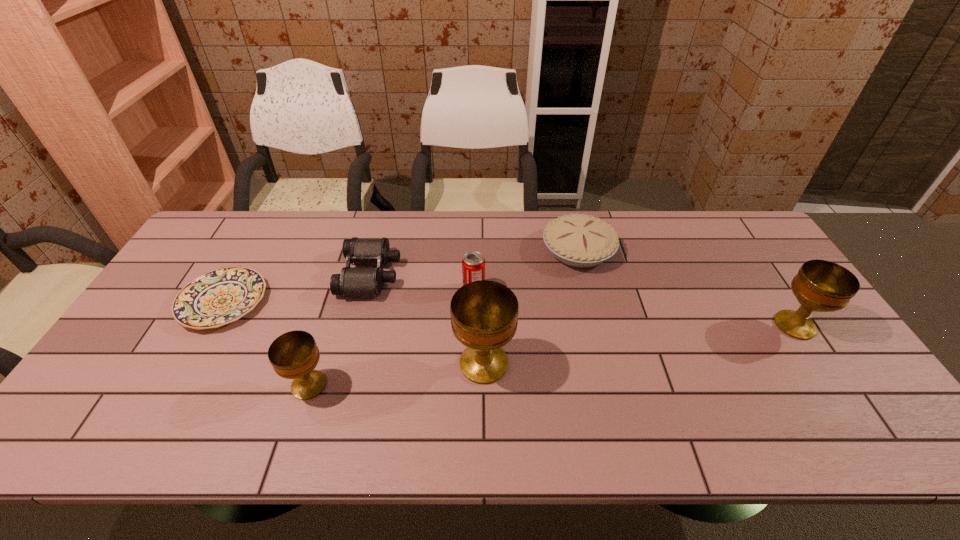
To make them evenly spaced by inserting another chalice among them, please locate a vacant spot for this new chalice. Please provide its 2D coordinates. Your answer should be formatted as a tuple, i.e. [(x, y)], where the tuple contains the x and y coordinates of a point satisfying the conditions above.

[(645, 343)]